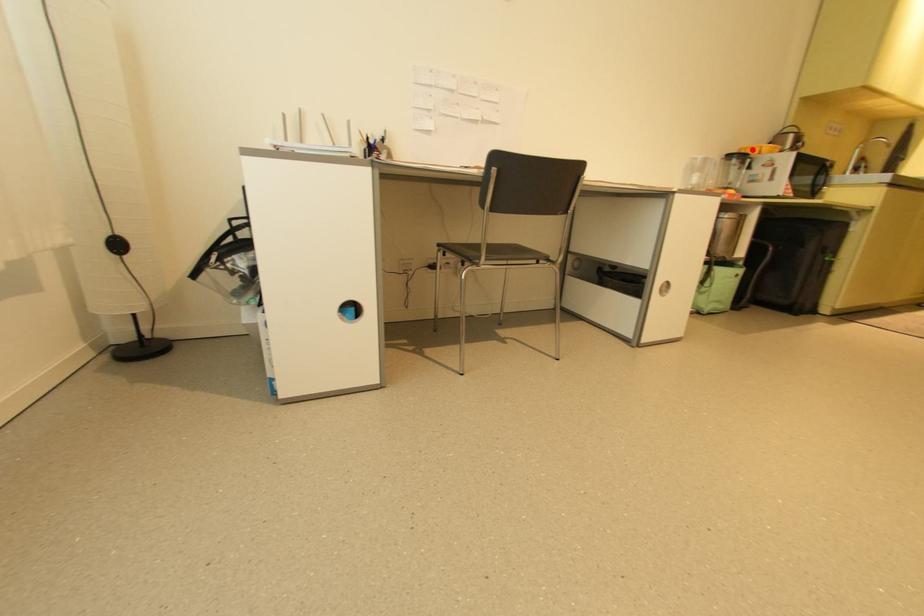
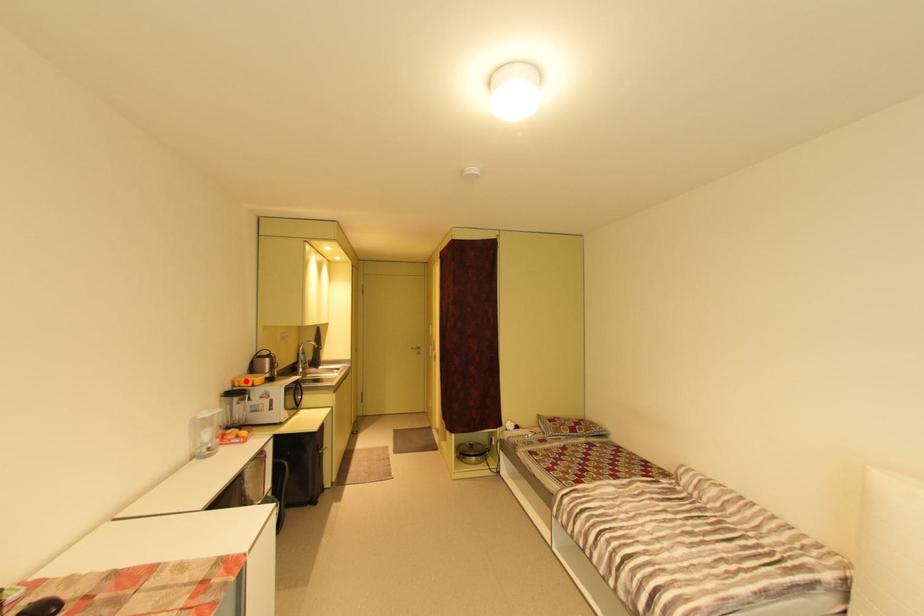
I am providing you with two images of the same scene from different viewpoints. A red point is marked on the first image and another point is marked on the second image. Is the marked point in image1 the same physical position as the marked point in image2?

Yes